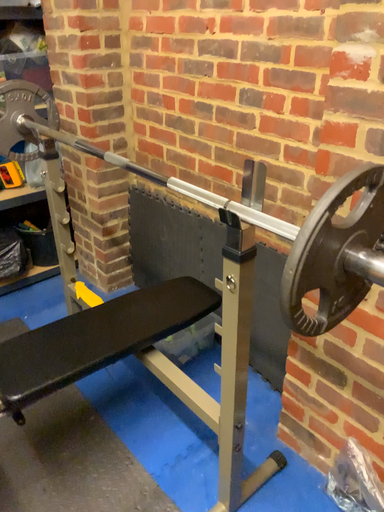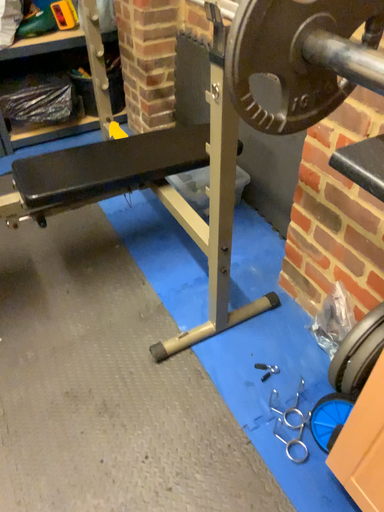
Question: How did the camera likely rotate when shooting the video?

Choices:
 (A) rotated left
 (B) rotated right

Answer: (A)